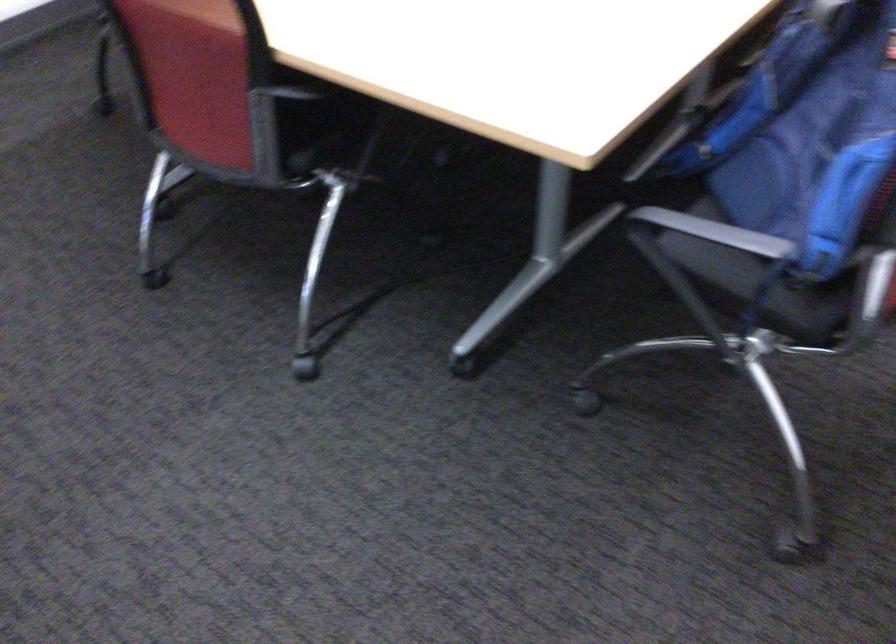
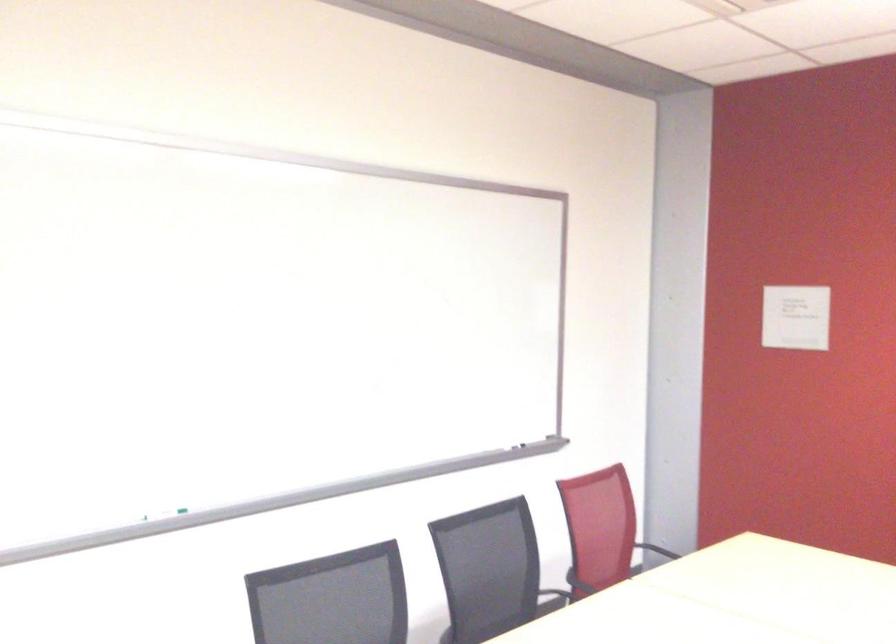
Question: The first image is from the beginning of the video and the second image is from the end. How did the camera likely rotate when shooting the video?

Choices:
 (A) Left
 (B) Right
 (C) Up
 (D) Down

Answer: (C)